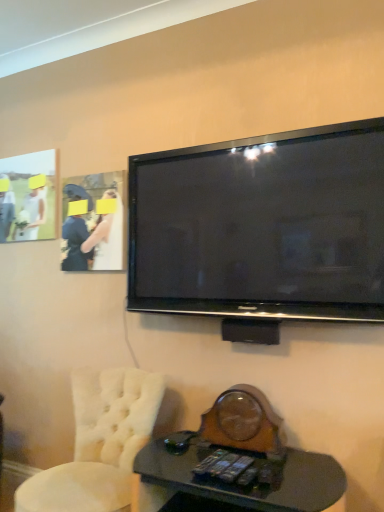
Question: Is matte white dress at upper left a part of black glass desk at lower center?

Choices:
 (A) no
 (B) yes

Answer: (A)

Question: Is black glass desk at lower center aimed at matte white dress at upper left?

Choices:
 (A) yes
 (B) no

Answer: (B)

Question: From the image's perspective, does black glass desk at lower center appear lower than matte white dress at upper left?

Choices:
 (A) no
 (B) yes

Answer: (B)

Question: Is black glass desk at lower center looking in the opposite direction of matte white dress at upper left?

Choices:
 (A) yes
 (B) no

Answer: (B)

Question: Are black glass desk at lower center and matte white dress at upper left far apart?

Choices:
 (A) no
 (B) yes

Answer: (B)

Question: From the image's perspective, is black glossy flat-screen tv at upper center above or below matte white dress at upper left?

Choices:
 (A) below
 (B) above

Answer: (A)

Question: Is black glossy flat-screen tv at upper center to the left or to the right of matte white dress at upper left in the image?

Choices:
 (A) right
 (B) left

Answer: (A)

Question: Is black glossy flat-screen tv at upper center taller or shorter than matte white dress at upper left?

Choices:
 (A) short
 (B) tall

Answer: (B)

Question: Considering the positions of black glossy flat-screen tv at upper center and matte white dress at upper left in the image, is black glossy flat-screen tv at upper center bigger or smaller than matte white dress at upper left?

Choices:
 (A) big
 (B) small

Answer: (A)

Question: In terms of width, does black glass desk at lower center look wider or thinner when compared to matte white dress at upper left?

Choices:
 (A) wide
 (B) thin

Answer: (A)

Question: Is black glass desk at lower center in front of or behind matte white dress at upper left in the image?

Choices:
 (A) front
 (B) behind

Answer: (A)

Question: Is point (215, 501) closer or farther from the camera than point (119, 259)?

Choices:
 (A) farther
 (B) closer

Answer: (B)

Question: From the image's perspective, is black glass desk at lower center located above or below matte white dress at upper left?

Choices:
 (A) above
 (B) below

Answer: (B)

Question: Is point (114, 192) closer or farther from the camera than point (124, 440)?

Choices:
 (A) closer
 (B) farther

Answer: (B)

Question: In the image, is matte white dress at upper left positioned in front of or behind white tufted chair at lower left?

Choices:
 (A) front
 (B) behind

Answer: (B)